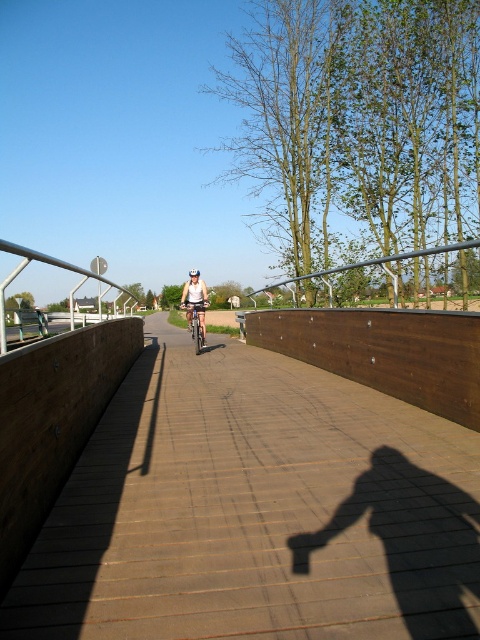
You are standing on the wooden bridge and want to place a small potted plant exactly where the brown wooden path at center is located. According to the coordinates provided, where should you place the potted plant?

You should place the potted plant at the coordinates point (255, 509) where the brown wooden path at center is located.

You are standing on the wooden bridge and want to walk from point (x=193, y=275) to point (x=205, y=330). Which direction should you move to get closer to the camera?

You should move towards point (x=205, y=330) because it is closer to the camera compared to point (x=193, y=275).

You are standing at the point labeled point (197, 285) and want to walk to the point labeled point (376, 538). Which direction should you face to walk directly towards your destination?

You should face towards the direction of point (376, 538), which is in front of point (197, 285).